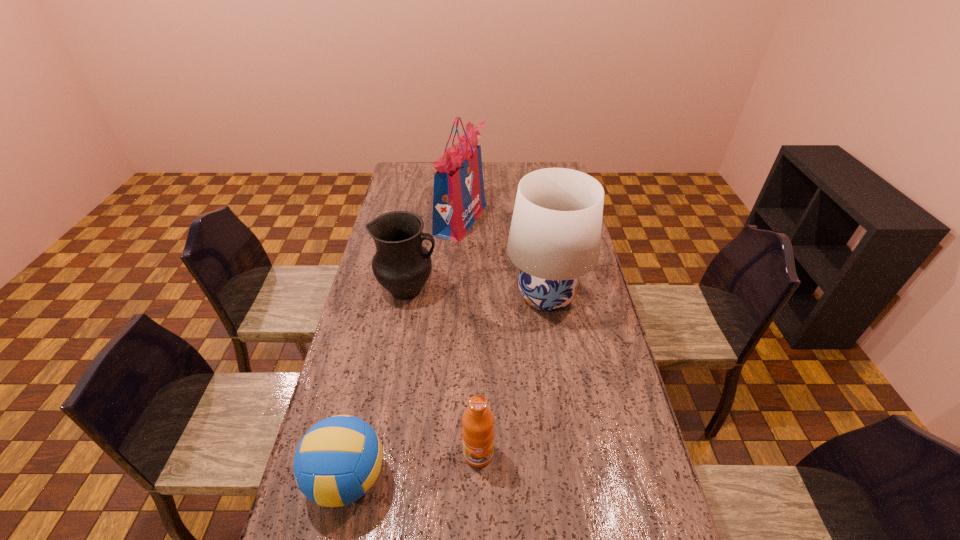
Image resolution: width=960 pixels, height=540 pixels. I want to click on free point located on the label side of the fourth tallest object, so click(x=478, y=492).

Identify the location of vacant area situated on the right of the shortest object. This screenshot has height=540, width=960. (534, 478).

The height and width of the screenshot is (540, 960). Find the location of `pitcher that is at the left edge`. pitcher that is at the left edge is located at coordinates (402, 265).

You are a GUI agent. You are given a task and a screenshot of the screen. Output one action in this format:
    pyautogui.click(x=<x>, y=<y>)
    Task: Click on the volleyball that is positioned at the left edge
    This screenshot has width=960, height=540.
    Given the screenshot: What is the action you would take?
    pyautogui.click(x=338, y=460)

You are a GUI agent. You are given a task and a screenshot of the screen. Output one action in this format:
    pyautogui.click(x=<x>, y=<y>)
    Task: Click on the object at the right edge
    Image resolution: width=960 pixels, height=540 pixels.
    Given the screenshot: What is the action you would take?
    pyautogui.click(x=555, y=234)

The height and width of the screenshot is (540, 960). I want to click on vacant area at the left edge, so pyautogui.click(x=410, y=186).

This screenshot has width=960, height=540. Identify the location of free space at the far left corner. (413, 164).

You are a GUI agent. You are given a task and a screenshot of the screen. Output one action in this format:
    pyautogui.click(x=<x>, y=<y>)
    Task: Click on the vacant space in between the farthest object and the fruit juice
    
    Given the screenshot: What is the action you would take?
    pyautogui.click(x=469, y=336)

You are a GUI agent. You are given a task and a screenshot of the screen. Output one action in this format:
    pyautogui.click(x=<x>, y=<y>)
    Task: Click on the free spot between the lampshade and the shortest object
    The image size is (960, 540).
    Given the screenshot: What is the action you would take?
    pyautogui.click(x=446, y=387)

The height and width of the screenshot is (540, 960). I want to click on free space that is in between the third shortest object and the volleyball, so 378,384.